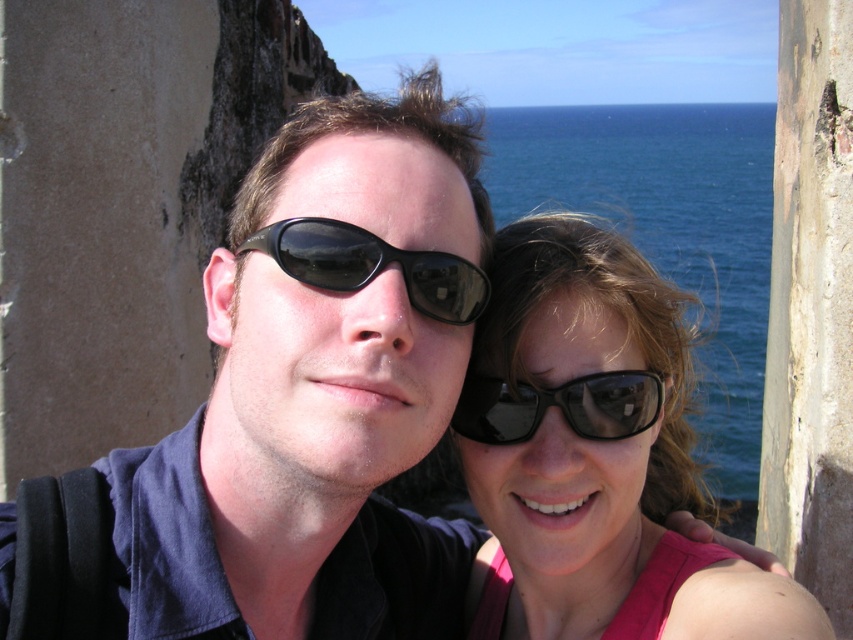
You are a photographer trying to fit both the pink matte sunglasses at center and the black plastic sunglasses at center into a rectangular frame. Which sunglasses have a greater width that might require more horizontal space?

The pink matte sunglasses at center have a greater width than the black plastic sunglasses at center, so they require more horizontal space.

You are a photographer standing at the camera position. You want to hand the pink matte sunglasses at center to the person in the image. Can you reach them without moving from your current position?

The pink matte sunglasses at center and camera are 9.25 meters apart, so you cannot reach them without moving from your current position since the distance is too far.

You are a photographer trying to capture a clear shot of both the black reflective sunglasses at center and the black plastic sunglasses at center. Since they are both at the center, which one might be blocking the other from view?

The black reflective sunglasses at center is positioned over black plastic sunglasses at center, so it is blocking the view of the latter.